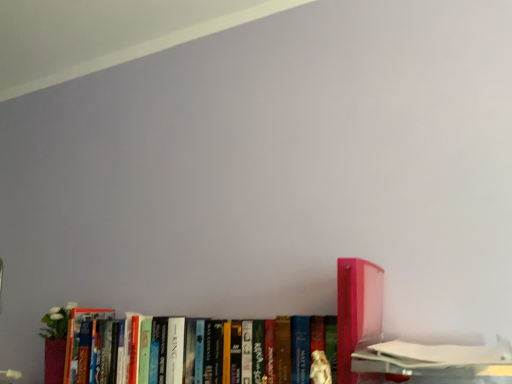
I want to click on hardcover book at center, marked as the third book in a right-to-left arrangement, so click(x=205, y=350).

What do you see at coordinates (205, 350) in the screenshot? I see `hardcover book at center, arranged as the first book when viewed from the left` at bounding box center [205, 350].

The height and width of the screenshot is (384, 512). What do you see at coordinates (445, 352) in the screenshot? I see `matte cardboard book at lower right, which is the 3th book in left-to-right order` at bounding box center [445, 352].

Locate an element on the screen. The image size is (512, 384). hardcover book at center, arranged as the first book when viewed from the left is located at coordinates (205, 350).

Is hardcover book at center, marked as the third book in a right-to-left arrangement, far from pink plastic book at right, placed as the second book when sorted from left to right?

No, hardcover book at center, marked as the third book in a right-to-left arrangement, is in close proximity to pink plastic book at right, placed as the second book when sorted from left to right.

From the picture: Is hardcover book at center, marked as the third book in a right-to-left arrangement, wider than pink plastic book at right, placed as the second book when sorted from left to right?

In fact, hardcover book at center, marked as the third book in a right-to-left arrangement, might be narrower than pink plastic book at right, placed as the second book when sorted from left to right.

What's the angular difference between hardcover book at center, marked as the third book in a right-to-left arrangement, and pink plastic book at right, the second book positioned from the right,'s facing directions?

The angular difference between hardcover book at center, marked as the third book in a right-to-left arrangement, and pink plastic book at right, the second book positioned from the right, is 0.697 degrees.

Looking at this image, from the image's perspective, between hardcover book at center, arranged as the first book when viewed from the left, and pink plastic book at right, the second book positioned from the right, which one is located above?

pink plastic book at right, the second book positioned from the right, from the image's perspective.

Is matte cardboard book at lower right, which is the 1th book from right to left, bigger or smaller than pink plastic book at right, the second book positioned from the right?

Clearly, matte cardboard book at lower right, which is the 1th book from right to left, is larger in size than pink plastic book at right, the second book positioned from the right.

Which is correct: matte cardboard book at lower right, which is the 3th book in left-to-right order, is inside pink plastic book at right, the second book positioned from the right, or outside of it?

matte cardboard book at lower right, which is the 3th book in left-to-right order, is not inside pink plastic book at right, the second book positioned from the right, it's outside.

Considering the relative positions of matte cardboard book at lower right, which is the 3th book in left-to-right order, and pink plastic book at right, placed as the second book when sorted from left to right, in the image provided, is matte cardboard book at lower right, which is the 3th book in left-to-right order, behind pink plastic book at right, placed as the second book when sorted from left to right,?

That is False.

From the image's perspective, does matte cardboard book at lower right, which is the 1th book from right to left, appear higher than pink plastic book at right, the second book positioned from the right?

No.

From the image's perspective, who appears lower, hardcover book at center, marked as the third book in a right-to-left arrangement, or matte cardboard book at lower right, which is the 1th book from right to left?

hardcover book at center, marked as the third book in a right-to-left arrangement, from the image's perspective.

Consider the image. Between hardcover book at center, marked as the third book in a right-to-left arrangement, and matte cardboard book at lower right, which is the 1th book from right to left, which one has more height?

hardcover book at center, marked as the third book in a right-to-left arrangement, is taller.

Based on the photo, does hardcover book at center, marked as the third book in a right-to-left arrangement, have a greater width compared to matte cardboard book at lower right, which is the 1th book from right to left?

Incorrect, the width of hardcover book at center, marked as the third book in a right-to-left arrangement, does not surpass that of matte cardboard book at lower right, which is the 1th book from right to left.

Is point (370, 327) positioned before point (457, 345)?

No, (370, 327) is behind (457, 345).

From a real-world perspective, is pink plastic book at right, the second book positioned from the right, physically above matte cardboard book at lower right, which is the 1th book from right to left?

Indeed, from a real-world perspective, pink plastic book at right, the second book positioned from the right, stands above matte cardboard book at lower right, which is the 1th book from right to left.

From the image's perspective, is pink plastic book at right, the second book positioned from the right, above matte cardboard book at lower right, which is the 1th book from right to left?

Correct, pink plastic book at right, the second book positioned from the right, appears higher than matte cardboard book at lower right, which is the 1th book from right to left, in the image.

Is pink plastic book at right, placed as the second book when sorted from left to right, positioned behind matte cardboard book at lower right, which is the 3th book in left-to-right order?

That is True.

From the image's perspective, is pink plastic book at right, placed as the second book when sorted from left to right, located above or below hardcover book at center, marked as the third book in a right-to-left arrangement?

pink plastic book at right, placed as the second book when sorted from left to right, is situated higher than hardcover book at center, marked as the third book in a right-to-left arrangement, in the image.

Based on their sizes in the image, would you say pink plastic book at right, the second book positioned from the right, is bigger or smaller than hardcover book at center, arranged as the first book when viewed from the left?

Considering their sizes, pink plastic book at right, the second book positioned from the right, takes up less space than hardcover book at center, arranged as the first book when viewed from the left.

Which is nearer, [361,265] or [248,326]?

Clearly, point [361,265] is closer to the camera than point [248,326].

Is pink plastic book at right, the second book positioned from the right, not inside hardcover book at center, marked as the third book in a right-to-left arrangement?

Indeed, pink plastic book at right, the second book positioned from the right, is completely outside hardcover book at center, marked as the third book in a right-to-left arrangement.

From a real-world perspective, is matte cardboard book at lower right, which is the 3th book in left-to-right order, positioned under hardcover book at center, marked as the third book in a right-to-left arrangement, based on gravity?

Yes.

Can we say matte cardboard book at lower right, which is the 1th book from right to left, lies outside hardcover book at center, marked as the third book in a right-to-left arrangement?

Yes, matte cardboard book at lower right, which is the 1th book from right to left, is outside of hardcover book at center, marked as the third book in a right-to-left arrangement.

Would you consider matte cardboard book at lower right, which is the 1th book from right to left, to be distant from hardcover book at center, arranged as the first book when viewed from the left?

matte cardboard book at lower right, which is the 1th book from right to left, is near hardcover book at center, arranged as the first book when viewed from the left, not far away.

Is the depth of matte cardboard book at lower right, which is the 1th book from right to left, greater than that of hardcover book at center, arranged as the first book when viewed from the left?

No.

The height and width of the screenshot is (384, 512). I want to click on book located above the hardcover book at center, marked as the third book in a right-to-left arrangement (from a real-world perspective), so click(x=357, y=310).

Locate an element on the screen. This screenshot has width=512, height=384. the 1st book below the pink plastic book at right, placed as the second book when sorted from left to right (from the image's perspective) is located at coordinates (x=445, y=352).

Considering their positions, is pink plastic book at right, the second book positioned from the right, positioned further to matte cardboard book at lower right, which is the 3th book in left-to-right order, than hardcover book at center, arranged as the first book when viewed from the left?

The object further to matte cardboard book at lower right, which is the 3th book in left-to-right order, is hardcover book at center, arranged as the first book when viewed from the left.

Based on their spatial positions, is hardcover book at center, arranged as the first book when viewed from the left, or matte cardboard book at lower right, which is the 1th book from right to left, closer to pink plastic book at right, placed as the second book when sorted from left to right?

matte cardboard book at lower right, which is the 1th book from right to left, lies closer to pink plastic book at right, placed as the second book when sorted from left to right, than the other object.

From the image, which object appears to be nearer to hardcover book at center, arranged as the first book when viewed from the left, pink plastic book at right, the second book positioned from the right, or matte cardboard book at lower right, which is the 1th book from right to left?

Based on the image, pink plastic book at right, the second book positioned from the right, appears to be nearer to hardcover book at center, arranged as the first book when viewed from the left.

When comparing their distances from hardcover book at center, marked as the third book in a right-to-left arrangement, does matte cardboard book at lower right, which is the 1th book from right to left, or pink plastic book at right, the second book positioned from the right, seem closer?

pink plastic book at right, the second book positioned from the right, is positioned closer to the anchor hardcover book at center, marked as the third book in a right-to-left arrangement.

Estimate the real-world distances between objects in this image. Which object is further from pink plastic book at right, the second book positioned from the right, matte cardboard book at lower right, which is the 1th book from right to left, or hardcover book at center, arranged as the first book when viewed from the left?

hardcover book at center, arranged as the first book when viewed from the left.

When comparing their distances from matte cardboard book at lower right, which is the 3th book in left-to-right order, does hardcover book at center, arranged as the first book when viewed from the left, or pink plastic book at right, the second book positioned from the right, seem further?

hardcover book at center, arranged as the first book when viewed from the left, is positioned further to the anchor matte cardboard book at lower right, which is the 3th book in left-to-right order.

You are a GUI agent. You are given a task and a screenshot of the screen. Output one action in this format:
    pyautogui.click(x=<x>, y=<y>)
    Task: Click on the book between hardcover book at center, marked as the third book in a right-to-left arrangement, and matte cardboard book at lower right, which is the 3th book in left-to-right order, from left to right
    Image resolution: width=512 pixels, height=384 pixels.
    Given the screenshot: What is the action you would take?
    pyautogui.click(x=357, y=310)